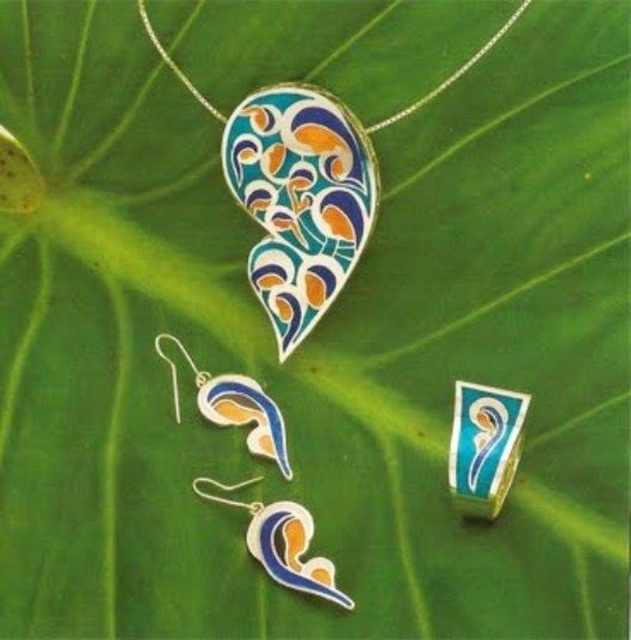
From the picture: Is enamel painted butterfly at center closer to the viewer compared to enamel pendant at upper center?

No, it is behind enamel pendant at upper center.

Can you confirm if enamel painted butterfly at center is positioned to the left of enamel pendant at upper center?

Correct, you'll find enamel painted butterfly at center to the left of enamel pendant at upper center.

Who is more forward, (297, 248) or (143, 17)?

Positioned in front is point (143, 17).

Identify the location of enamel painted butterfly at center. The width and height of the screenshot is (631, 640). click(298, 200).

Who is lower down, matte enamel earring at lower center or enamel pendant at upper center?

matte enamel earring at lower center

Measure the distance from matte enamel earring at lower center to enamel pendant at upper center.

The distance of matte enamel earring at lower center from enamel pendant at upper center is 49.91 centimeters.

What do you see at coordinates (281, 541) in the screenshot? I see `matte enamel earring at lower center` at bounding box center [281, 541].

Where is `matte enamel earring at lower center`? matte enamel earring at lower center is located at coordinates (281, 541).

Is enamel painted butterfly at center wider than matte enamel earring at lower center?

No.

Is enamel painted butterfly at center thinner than matte enamel earring at lower center?

Indeed, enamel painted butterfly at center has a lesser width compared to matte enamel earring at lower center.

Who is more distant from viewer, (350, 118) or (307, 566)?

Point (350, 118)

Identify the location of enamel painted butterfly at center. (298, 200).